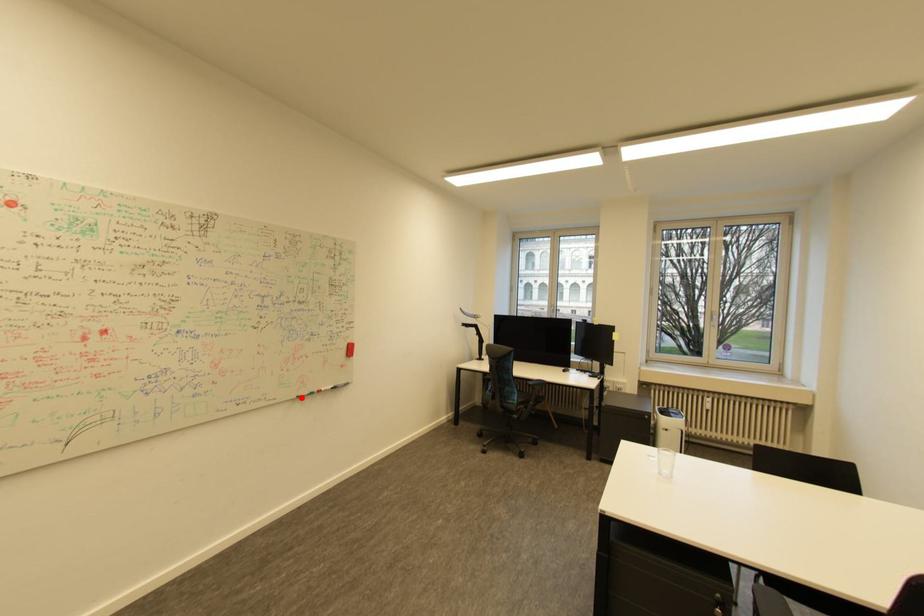
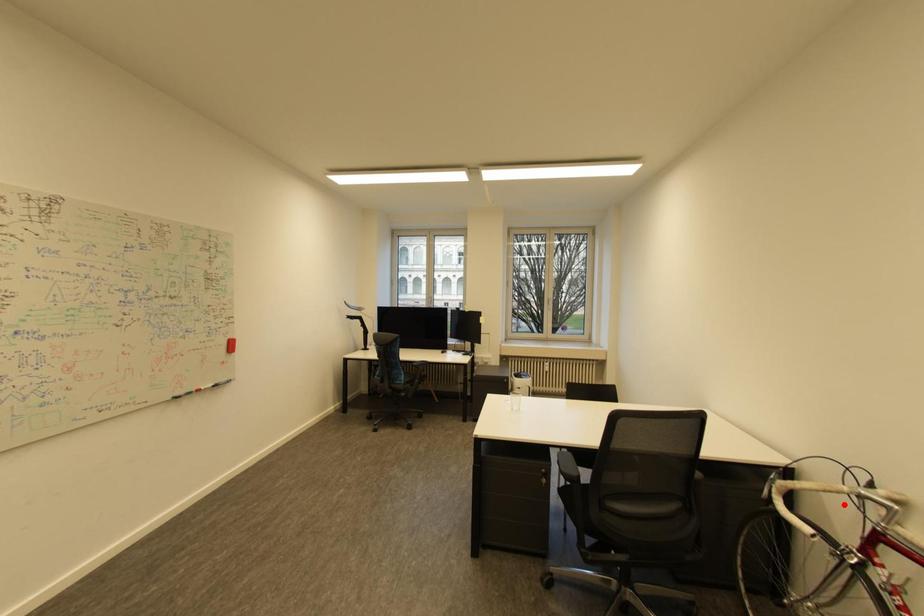
I am providing you with two images of the same scene from different viewpoints. A red point is marked on the first image and another point is marked on the second image. Is the marked point in image1 the same physical position as the marked point in image2?

No